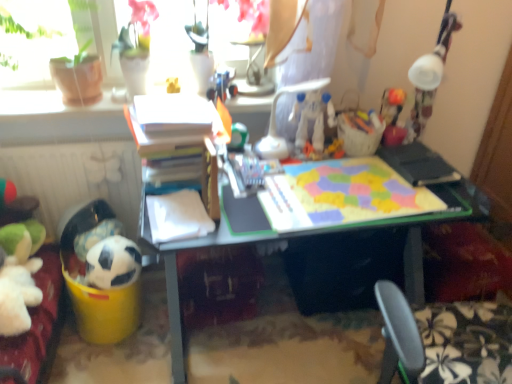
Locate an element on the screen. The image size is (512, 384). free space in front of white plastic robot at center, which ranks as the third toy in bottom-to-top order is located at coordinates (318, 171).